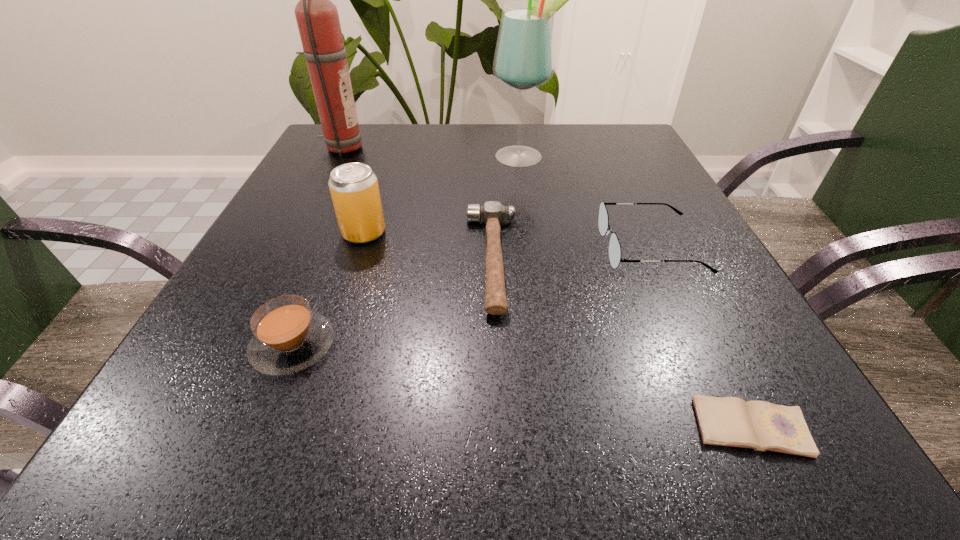
At what (x,y) coordinates should I click in order to perform the action: click on fire extinguisher positioned at the far edge. Please return your answer as a coordinate pair (x, y). Image resolution: width=960 pixels, height=540 pixels. Looking at the image, I should click on (317, 18).

Locate an element on the screen. The height and width of the screenshot is (540, 960). object at the near edge is located at coordinates (728, 421).

Locate an element on the screen. fire extinguisher that is at the left edge is located at coordinates (317, 18).

Where is `pop (soda) that is positioned at the left edge`? The height and width of the screenshot is (540, 960). pop (soda) that is positioned at the left edge is located at coordinates (354, 189).

Locate an element on the screen. This screenshot has width=960, height=540. cappuccino at the left edge is located at coordinates (289, 337).

Find the location of a particular element. The width and height of the screenshot is (960, 540). spectacles positioned at the right edge is located at coordinates point(614,246).

In order to click on diary that is at the right edge in this screenshot , I will do `click(728, 421)`.

You are a GUI agent. You are given a task and a screenshot of the screen. Output one action in this format:
    pyautogui.click(x=<x>, y=<y>)
    Task: Click on the object that is at the far left corner
    The height and width of the screenshot is (540, 960).
    Given the screenshot: What is the action you would take?
    pyautogui.click(x=317, y=18)

Find the location of `object located at the near right corner`. object located at the near right corner is located at coordinates (728, 421).

Where is `free region at the far edge of the desktop`? This screenshot has height=540, width=960. free region at the far edge of the desktop is located at coordinates (430, 141).